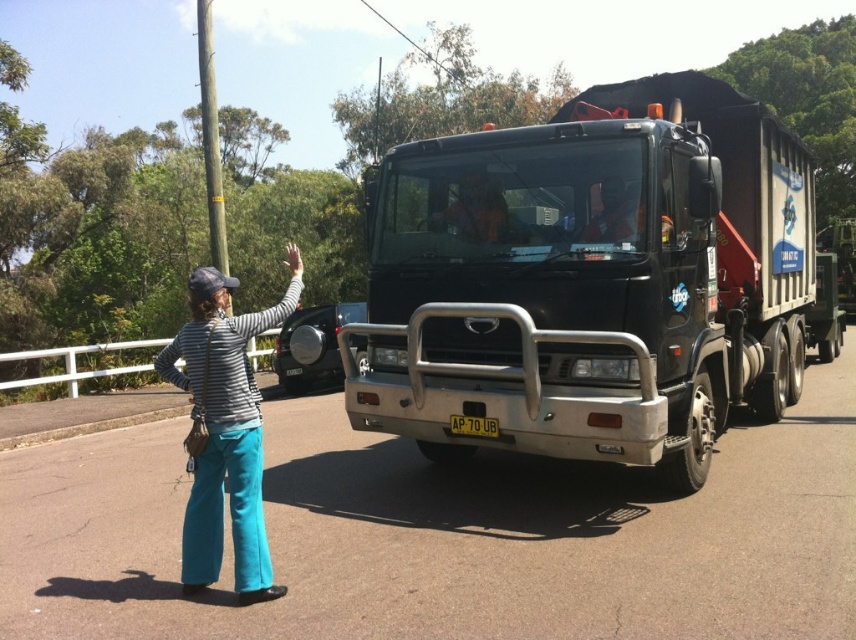
You are a pedestrian standing on the side of the road. You see the black metallic truck at center and the striped fabric shirt at left. Which object is closer to you?

The striped fabric shirt at left is closer to you because it is not as far as the black metallic truck at center, which is further away.

You are a delivery driver who needs to park your truck in a space that is exactly the width of the striped fabric shirt at left. Can your black metallic truck at center fit into this parking space?

The black metallic truck at center is wider than the striped fabric shirt at left, so it cannot fit into a parking space that is exactly the width of the striped fabric shirt at left.

You are a pedestrian standing on the side of the road. You see a striped fabric shirt at left and a yellow plastic license plate at center. Which object is closer to you?

The striped fabric shirt at left is closer to you because it is in front of the yellow plastic license plate at center.